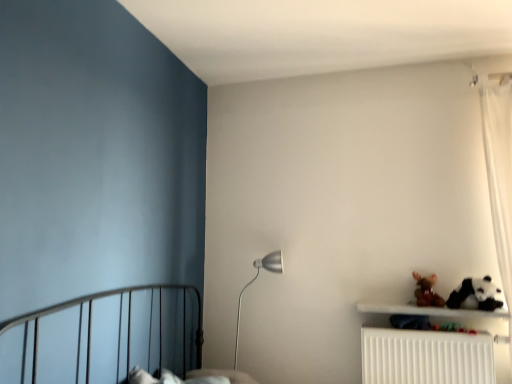
In the scene shown: In order to face white plush panda at lower right, should I rotate leftwards or rightwards?

Rotate your view right by about 26.972°.

At what (x,y) coordinates should I click in order to perform the action: click on white plastic radiator at lower right. Please return your answer as a coordinate pair (x, y). This screenshot has width=512, height=384. Looking at the image, I should click on (425, 357).

Find the location of a particular element. radiator directly beneath the white plush panda at lower right (from a real-world perspective) is located at coordinates pyautogui.click(x=425, y=357).

Looking at this image, between white plush panda at lower right and white plastic radiator at lower right, which one appears on the left side from the viewer's perspective?

white plastic radiator at lower right.

Based on the photo, is white plush panda at lower right positioned in front of white plastic radiator at lower right?

No, the depth of white plush panda at lower right is greater than that of white plastic radiator at lower right.

How many degrees apart are the facing directions of white plush panda at lower right and white plastic radiator at lower right?

There is a 0.0923-degree angle between the facing directions of white plush panda at lower right and white plastic radiator at lower right.

Does brown plush toy at upper right have a lesser height compared to white plush panda at lower right?

Yes.

Who is bigger, brown plush toy at upper right or white plush panda at lower right?

white plush panda at lower right.

Consider the image. Is brown plush toy at upper right to the left or to the right of white plush panda at lower right in the image?

Clearly, brown plush toy at upper right is on the left of white plush panda at lower right in the image.

Is silver metallic floor lamp at center not within white plastic radiator at lower right?

silver metallic floor lamp at center is positioned outside white plastic radiator at lower right.

Is the position of silver metallic floor lamp at center less distant than that of white plastic radiator at lower right?

No, silver metallic floor lamp at center is behind white plastic radiator at lower right.

The image size is (512, 384). Identify the location of table lamp above the white plastic radiator at lower right (from the image's perspective). (253, 281).

Considering the relative sizes of silver metallic floor lamp at center and white plastic radiator at lower right in the image provided, is silver metallic floor lamp at center bigger than white plastic radiator at lower right?

Incorrect, silver metallic floor lamp at center is not larger than white plastic radiator at lower right.

Is silver metallic floor lamp at center located within brown plush toy at upper right?

No.

This screenshot has width=512, height=384. In order to click on toy above the silver metallic floor lamp at center (from the image's perspective) in this screenshot , I will do `click(426, 291)`.

Is brown plush toy at upper right directly adjacent to silver metallic floor lamp at center?

No, brown plush toy at upper right is not beside silver metallic floor lamp at center.

From a real-world perspective, does brown plush toy at upper right sit lower than silver metallic floor lamp at center?

No, from a real-world perspective, brown plush toy at upper right is not under silver metallic floor lamp at center.

Considering the sizes of objects silver metallic floor lamp at center and white plush panda at lower right in the image provided, who is smaller, silver metallic floor lamp at center or white plush panda at lower right?

white plush panda at lower right is smaller.

At what (x,y) coordinates should I click in order to perform the action: click on animal that is in front of the silver metallic floor lamp at center. Please return your answer as a coordinate pair (x, y). The height and width of the screenshot is (384, 512). Looking at the image, I should click on (476, 294).

Considering the positions of objects silver metallic floor lamp at center and white plush panda at lower right in the image provided, who is more to the right, silver metallic floor lamp at center or white plush panda at lower right?

white plush panda at lower right.

Based on their sizes in the image, would you say white plush panda at lower right is bigger or smaller than brown plush toy at upper right?

Considering their sizes, white plush panda at lower right takes up more space than brown plush toy at upper right.

From the image's perspective, is white plush panda at lower right positioned above or below brown plush toy at upper right?

From the image's perspective, white plush panda at lower right appears above brown plush toy at upper right.

Considering the relative sizes of white plush panda at lower right and brown plush toy at upper right in the image provided, is white plush panda at lower right shorter than brown plush toy at upper right?

No, white plush panda at lower right is not shorter than brown plush toy at upper right.

Which object is positioned more to the left, white plush panda at lower right or brown plush toy at upper right?

brown plush toy at upper right is more to the left.

Can you confirm if silver metallic floor lamp at center is shorter than brown plush toy at upper right?

In fact, silver metallic floor lamp at center may be taller than brown plush toy at upper right.

Is silver metallic floor lamp at center inside the boundaries of brown plush toy at upper right, or outside?

The correct answer is: outside.

From the image's perspective, does silver metallic floor lamp at center appear lower than brown plush toy at upper right?

Yes, from the image's perspective, silver metallic floor lamp at center is below brown plush toy at upper right.

Identify the location of radiator lying in front of the white plush panda at lower right. Image resolution: width=512 pixels, height=384 pixels. (425, 357).

Where is `animal below the brown plush toy at upper right (from a real-world perspective)`? This screenshot has width=512, height=384. animal below the brown plush toy at upper right (from a real-world perspective) is located at coordinates (476, 294).

Looking at the image, which one is located further to white plastic radiator at lower right, silver metallic floor lamp at center or white plush panda at lower right?

The object further to white plastic radiator at lower right is silver metallic floor lamp at center.

Considering their positions, is brown plush toy at upper right positioned closer to white plastic radiator at lower right than silver metallic floor lamp at center?

The object closer to white plastic radiator at lower right is brown plush toy at upper right.

Which object lies further to the anchor point white plush panda at lower right, white plastic radiator at lower right or brown plush toy at upper right?

white plastic radiator at lower right is positioned further to the anchor white plush panda at lower right.

From the image, which object appears to be nearer to white plush panda at lower right, white plastic radiator at lower right or silver metallic floor lamp at center?

Among the two, white plastic radiator at lower right is located nearer to white plush panda at lower right.

Which object lies nearer to the anchor point brown plush toy at upper right, white plush panda at lower right or white plastic radiator at lower right?

The object closer to brown plush toy at upper right is white plush panda at lower right.

Estimate the real-world distances between objects in this image. Which object is closer to white plastic radiator at lower right, brown plush toy at upper right or white plush panda at lower right?

Among the two, brown plush toy at upper right is located nearer to white plastic radiator at lower right.

When comparing their distances from brown plush toy at upper right, does white plastic radiator at lower right or white plush panda at lower right seem further?

The object further to brown plush toy at upper right is white plastic radiator at lower right.

When comparing their distances from white plush panda at lower right, does brown plush toy at upper right or silver metallic floor lamp at center seem closer?

brown plush toy at upper right is closer to white plush panda at lower right.

Image resolution: width=512 pixels, height=384 pixels. I want to click on radiator between silver metallic floor lamp at center and white plush panda at lower right in the horizontal direction, so click(425, 357).

The height and width of the screenshot is (384, 512). Identify the location of toy situated between silver metallic floor lamp at center and white plush panda at lower right from left to right. (426, 291).

The height and width of the screenshot is (384, 512). I want to click on radiator located between silver metallic floor lamp at center and brown plush toy at upper right in the left-right direction, so click(425, 357).

I want to click on toy between white plush panda at lower right and white plastic radiator at lower right in the vertical direction, so click(x=426, y=291).